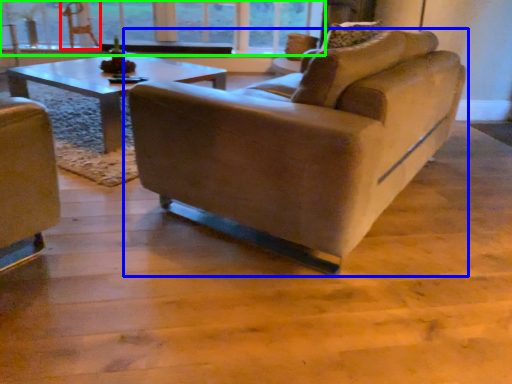
Question: Based on their relative distances, which object is farther from swivel chair (highlighted by a red box)? Choose from studio couch (highlighted by a blue box) and window (highlighted by a green box).

Choices:
 (A) studio couch
 (B) window

Answer: (A)